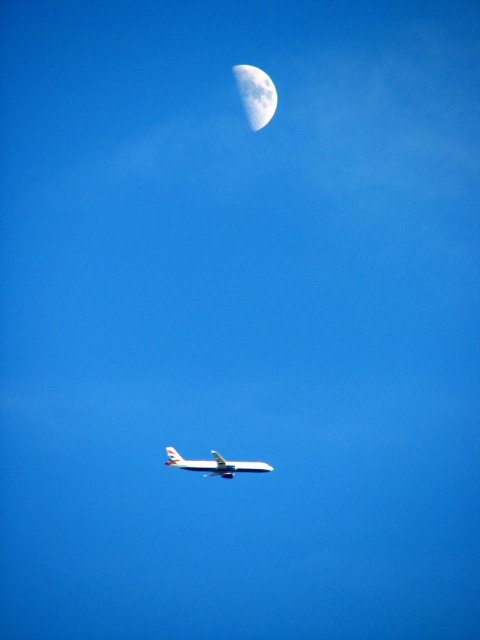
Is silver metallic moon at upper center further to the viewer compared to white matte airplane at center?

Yes, it is behind white matte airplane at center.

Does silver metallic moon at upper center come in front of white matte airplane at center?

No, it is behind white matte airplane at center.

Is point (264, 100) in front of point (216, 452)?

That is False.

This screenshot has width=480, height=640. I want to click on silver metallic moon at upper center, so click(255, 93).